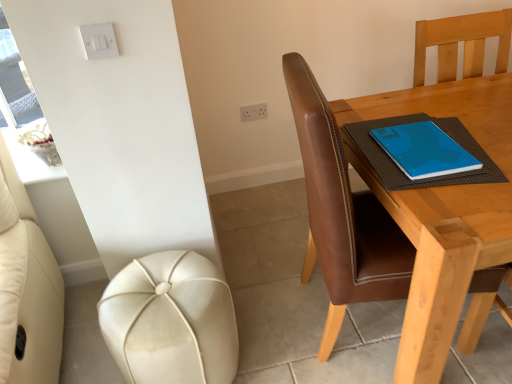
Find the location of a particular element. The image size is (512, 384). white plastic socket at upper center is located at coordinates (253, 112).

This screenshot has height=384, width=512. What are the coordinates of `white plastic light switch at upper left` in the screenshot? It's located at (99, 41).

At what (x,y) coordinates should I click in order to perform the action: click on brown leather chair at right. Please return your answer as a coordinate pair (x, y). The height and width of the screenshot is (384, 512). Looking at the image, I should click on (342, 213).

Based on their positions, is white plastic light switch at upper left located to the left or right of blue matte notebook at upper right?

From the image, it's evident that white plastic light switch at upper left is to the left of blue matte notebook at upper right.

From the picture: From a real-world perspective, is white plastic light switch at upper left physically below blue matte notebook at upper right?

Incorrect, from a real-world perspective, white plastic light switch at upper left is higher than blue matte notebook at upper right.

Considering the sizes of objects white plastic light switch at upper left and blue matte notebook at upper right in the image provided, who is shorter, white plastic light switch at upper left or blue matte notebook at upper right?

blue matte notebook at upper right is shorter.

Does brown leather chair at right have a larger size compared to blue matte notebook at upper right?

Correct, brown leather chair at right is larger in size than blue matte notebook at upper right.

Considering the sizes of objects brown leather chair at right and blue matte notebook at upper right in the image provided, who is shorter, brown leather chair at right or blue matte notebook at upper right?

With less height is blue matte notebook at upper right.

Does brown leather chair at right touch blue matte notebook at upper right?

No, brown leather chair at right is not beside blue matte notebook at upper right.

Considering the sizes of white plastic socket at upper center and white plastic light switch at upper left in the image, is white plastic socket at upper center wider or thinner than white plastic light switch at upper left?

Clearly, white plastic socket at upper center has more width compared to white plastic light switch at upper left.

From the image's perspective, is white plastic socket at upper center on white plastic light switch at upper left?

Yes, from the image's perspective, white plastic socket at upper center is over white plastic light switch at upper left.

Is point (432, 172) in front of point (479, 274)?

Yes, point (432, 172) is closer to viewer.

From a real-world perspective, is blue matte notebook at upper right located beneath brown leather chair at right?

No, from a real-world perspective, blue matte notebook at upper right is not beneath brown leather chair at right.

Considering the sizes of blue matte notebook at upper right and brown leather chair at right in the image, is blue matte notebook at upper right taller or shorter than brown leather chair at right?

In the image, blue matte notebook at upper right appears to be shorter than brown leather chair at right.

Between blue matte notebook at upper right and brown leather chair at right, which one appears on the left side from the viewer's perspective?

Positioned to the left is brown leather chair at right.

Which is behind, white plastic socket at upper center or blue matte notebook at upper right?

white plastic socket at upper center is more distant.

Is white plastic socket at upper center placed right next to blue matte notebook at upper right?

white plastic socket at upper center and blue matte notebook at upper right are not in contact.

Does white plastic socket at upper center have a lesser width compared to blue matte notebook at upper right?

Yes.

Is brown leather chair at right facing towards white plastic socket at upper center?

No, brown leather chair at right is not oriented towards white plastic socket at upper center.

Is white plastic socket at upper center a part of brown leather chair at right?

No, brown leather chair at right does not contain white plastic socket at upper center.

How many degrees apart are the facing directions of brown leather chair at right and white plastic socket at upper center?

The facing directions of brown leather chair at right and white plastic socket at upper center are 81.9 degrees apart.

Would you consider brown leather chair at right to be distant from white plastic socket at upper center?

Yes, brown leather chair at right and white plastic socket at upper center are quite far apart.

The height and width of the screenshot is (384, 512). In order to click on light switch above the leather-like cream stool at lower left (from the image's perspective) in this screenshot , I will do tap(99, 41).

Which is in front, white plastic light switch at upper left or leather-like cream stool at lower left?

white plastic light switch at upper left is in front.

Can you confirm if white plastic light switch at upper left is shorter than leather-like cream stool at lower left?

Yes, white plastic light switch at upper left is shorter than leather-like cream stool at lower left.

From the image's perspective, which one is positioned lower, white plastic light switch at upper left or leather-like cream stool at lower left?

leather-like cream stool at lower left.

Locate an element on the screen. Image resolution: width=512 pixels, height=384 pixels. notebook that is under the white plastic light switch at upper left (from a real-world perspective) is located at coordinates (424, 150).

The width and height of the screenshot is (512, 384). I want to click on notebook above the brown leather chair at right (from a real-world perspective), so click(x=424, y=150).

Which object lies further to the anchor point leather-like cream stool at lower left, white plastic socket at upper center or brown leather chair at right?

white plastic socket at upper center lies further to leather-like cream stool at lower left than the other object.

From the image, which object appears to be nearer to white plastic socket at upper center, brown leather chair at right or leather-like cream stool at lower left?

brown leather chair at right lies closer to white plastic socket at upper center than the other object.

Which object lies nearer to the anchor point brown leather chair at right, white plastic socket at upper center or white plastic light switch at upper left?

Among the two, white plastic light switch at upper left is located nearer to brown leather chair at right.

Looking at the image, which one is located further to blue matte notebook at upper right, white plastic light switch at upper left or leather-like cream stool at lower left?

white plastic light switch at upper left is further to blue matte notebook at upper right.

From the image, which object appears to be farther from leather-like cream stool at lower left, white plastic light switch at upper left or white plastic socket at upper center?

Among the two, white plastic socket at upper center is located further to leather-like cream stool at lower left.

Considering their positions, is white plastic socket at upper center positioned closer to brown leather chair at right than blue matte notebook at upper right?

blue matte notebook at upper right is closer to brown leather chair at right.

Looking at the image, which one is located closer to blue matte notebook at upper right, leather-like cream stool at lower left or white plastic light switch at upper left?

leather-like cream stool at lower left lies closer to blue matte notebook at upper right than the other object.

Considering their positions, is blue matte notebook at upper right positioned further to white plastic socket at upper center than brown leather chair at right?

Based on the image, brown leather chair at right appears to be further to white plastic socket at upper center.

What are the coordinates of `chair between leather-like cream stool at lower left and blue matte notebook at upper right in the horizontal direction` in the screenshot? It's located at (342, 213).

The height and width of the screenshot is (384, 512). Find the location of `notebook between white plastic light switch at upper left and white plastic socket at upper center in the front-back direction`. notebook between white plastic light switch at upper left and white plastic socket at upper center in the front-back direction is located at coordinates (424, 150).

Where is `notebook between leather-like cream stool at lower left and white plastic socket at upper center in the front-back direction`? The width and height of the screenshot is (512, 384). notebook between leather-like cream stool at lower left and white plastic socket at upper center in the front-back direction is located at coordinates (424, 150).

This screenshot has height=384, width=512. In order to click on notebook between brown leather chair at right and white plastic socket at upper center from front to back in this screenshot , I will do `click(424, 150)`.